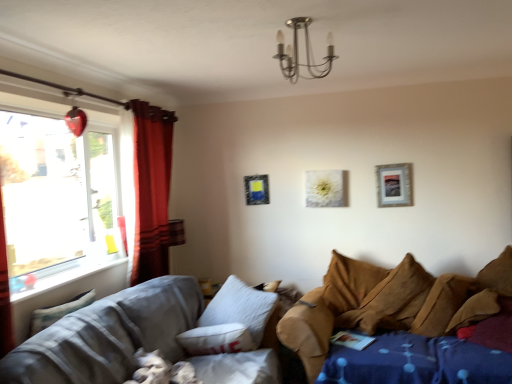
Question: Are fluffy white pillow at lower left, acting as the first pillow starting from the front, and brown fabric couch at lower right, which is the first studio couch in right-to-left order, far apart?

Choices:
 (A) no
 (B) yes

Answer: (B)

Question: From the image's perspective, would you say fluffy white pillow at lower left, acting as the first pillow starting from the front, is positioned over brown fabric couch at lower right, arranged as the 2th studio couch when viewed from the left?

Choices:
 (A) no
 (B) yes

Answer: (B)

Question: Does fluffy white pillow at lower left, positioned as the second pillow in back-to-front order, have a smaller size compared to brown fabric couch at lower right, arranged as the 2th studio couch when viewed from the left?

Choices:
 (A) no
 (B) yes

Answer: (B)

Question: Can you confirm if fluffy white pillow at lower left, marked as the 2th pillow in a right-to-left arrangement, is positioned to the right of brown fabric couch at lower right, arranged as the 2th studio couch when viewed from the left?

Choices:
 (A) no
 (B) yes

Answer: (A)

Question: Is fluffy white pillow at lower left, positioned as the second pillow in back-to-front order, oriented towards brown fabric couch at lower right, which is the first studio couch in right-to-left order?

Choices:
 (A) yes
 (B) no

Answer: (B)

Question: Looking at the image, does metallic chandelier at upper center seem bigger or smaller compared to red velvet curtain at left?

Choices:
 (A) big
 (B) small

Answer: (B)

Question: Is point coord(327,61) closer or farther from the camera than point coord(136,269)?

Choices:
 (A) closer
 (B) farther

Answer: (A)

Question: In terms of width, does metallic chandelier at upper center look wider or thinner when compared to red velvet curtain at left?

Choices:
 (A) thin
 (B) wide

Answer: (B)

Question: From a real-world perspective, relative to red velvet curtain at left, is metallic chandelier at upper center vertically above or below?

Choices:
 (A) below
 (B) above

Answer: (B)

Question: Do you think textured gray fabric couch at lower left, which is counted as the 2th studio couch, starting from the right, is within brown textured pillow at right, which appears as the second pillow when viewed from the front, or outside of it?

Choices:
 (A) inside
 (B) outside

Answer: (B)

Question: Is point (90, 359) positioned closer to the camera than point (502, 294)?

Choices:
 (A) farther
 (B) closer

Answer: (B)

Question: Is textured gray fabric couch at lower left, which ranks as the 1th studio couch in left-to-right order, taller or shorter than brown textured pillow at right, the 1th pillow in the right-to-left sequence?

Choices:
 (A) short
 (B) tall

Answer: (B)

Question: Considering the relative positions of textured gray fabric couch at lower left, which is counted as the 2th studio couch, starting from the right, and brown textured pillow at right, marked as the 2th pillow in a left-to-right arrangement, in the image provided, is textured gray fabric couch at lower left, which is counted as the 2th studio couch, starting from the right, to the left or to the right of brown textured pillow at right, marked as the 2th pillow in a left-to-right arrangement,?

Choices:
 (A) left
 (B) right

Answer: (A)

Question: Considering their positions, is white matte canvas at center, which ranks as the second picture frame in right-to-left order, located in front of or behind white painted wood at left?

Choices:
 (A) behind
 (B) front

Answer: (A)

Question: In terms of size, does white matte canvas at center, which ranks as the second picture frame in right-to-left order, appear bigger or smaller than white painted wood at left?

Choices:
 (A) big
 (B) small

Answer: (B)